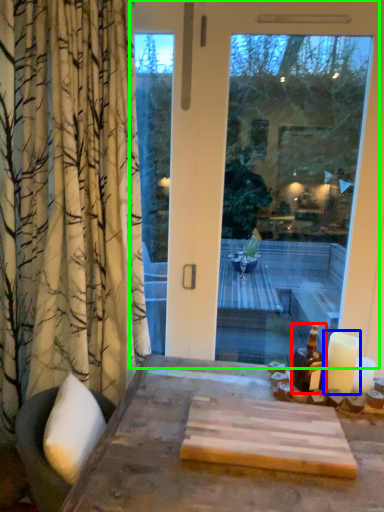
Question: Based on their relative distances, which object is farther from bottle (highlighted by a red box)? Choose from candle (highlighted by a blue box) and window (highlighted by a green box).

Choices:
 (A) candle
 (B) window

Answer: (B)